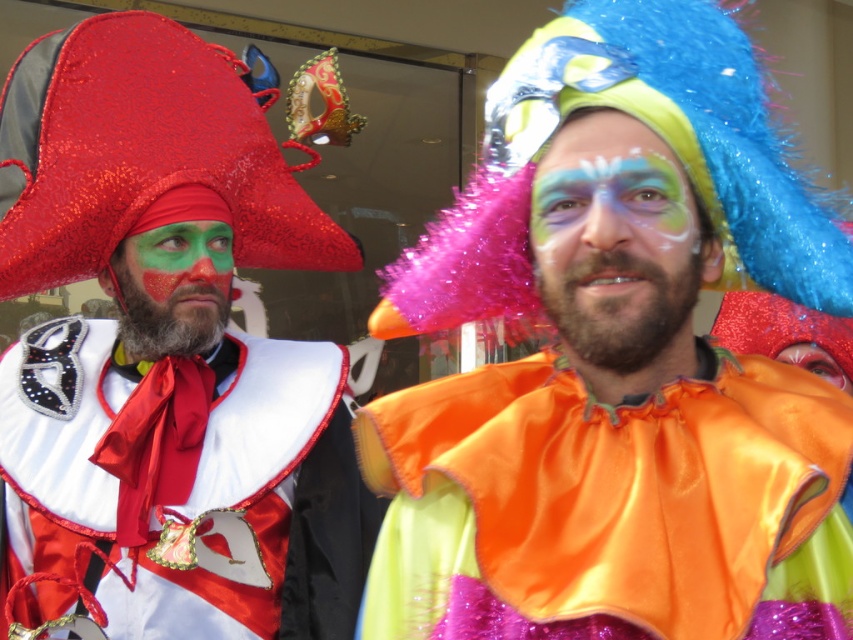
Question: Can you confirm if shiny satin cape at left is thinner than shiny orange fabric at center?

Choices:
 (A) yes
 (B) no

Answer: (B)

Question: Can you confirm if green matte face paint at center is thinner than shiny orange fabric at center?

Choices:
 (A) no
 (B) yes

Answer: (A)

Question: Based on their relative distances, which object is farther from the shiny orange fabric at center?

Choices:
 (A) green matte face paint at center
 (B) orange satin shirt at center
 (C) shiny red fabric hat at left

Answer: (B)

Question: Estimate the real-world distances between objects in this image. Which object is closer to the matte orange clown nose at center?

Choices:
 (A) shiny orange fabric at center
 (B) green matte face paint at center
 (C) orange satin shirt at center
 (D) shiny satin cape at left

Answer: (C)

Question: Can you confirm if shiny satin cape at left is smaller than shiny orange fabric at center?

Choices:
 (A) yes
 (B) no

Answer: (B)

Question: Which is nearer to the green matte face paint at center?

Choices:
 (A) orange satin clown costume at center
 (B) matte orange clown nose at center
 (C) orange satin shirt at center

Answer: (A)